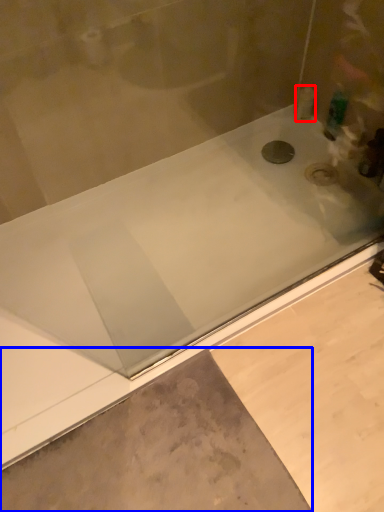
Question: Which object appears closest to the camera in this image, toiletry (highlighted by a red box) or concrete (highlighted by a blue box)?

Choices:
 (A) toiletry
 (B) concrete

Answer: (B)